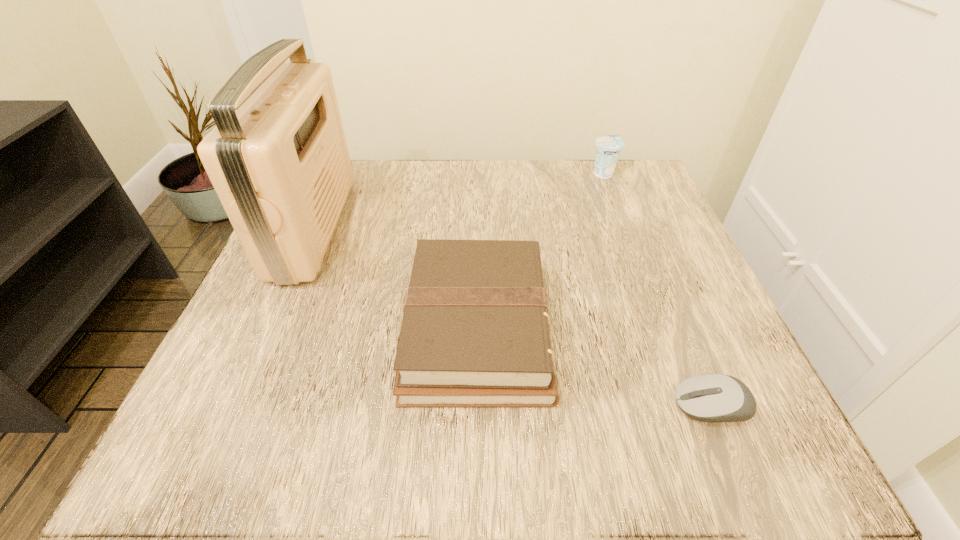
You are a GUI agent. You are given a task and a screenshot of the screen. Output one action in this format:
    pyautogui.click(x=<x>, y=<y>)
    Task: Click on the free spot between the yogurt and the Bible
    The width and height of the screenshot is (960, 540).
    Given the screenshot: What is the action you would take?
    point(540,251)

Locate an element on the screen. The image size is (960, 540). free space between the computer equipment and the second object from left to right is located at coordinates (594, 367).

Where is `unoccupied area between the yogurt and the shortest object`? Image resolution: width=960 pixels, height=540 pixels. unoccupied area between the yogurt and the shortest object is located at coordinates (658, 289).

Image resolution: width=960 pixels, height=540 pixels. What are the coordinates of `free spot between the computer equipment and the Bible` in the screenshot? It's located at (594, 367).

Find the location of a particular element. The height and width of the screenshot is (540, 960). empty space between the yogurt and the Bible is located at coordinates (540, 251).

Image resolution: width=960 pixels, height=540 pixels. I want to click on vacant space that is in between the Bible and the yogurt, so click(540, 251).

Locate which object is the third closest to the computer equipment. Please provide its 2D coordinates. Your answer should be formatted as a tuple, i.e. [(x, y)], where the tuple contains the x and y coordinates of a point satisfying the conditions above.

[(278, 159)]

Locate an element on the screen. The height and width of the screenshot is (540, 960). the closest object relative to the yogurt is located at coordinates click(475, 332).